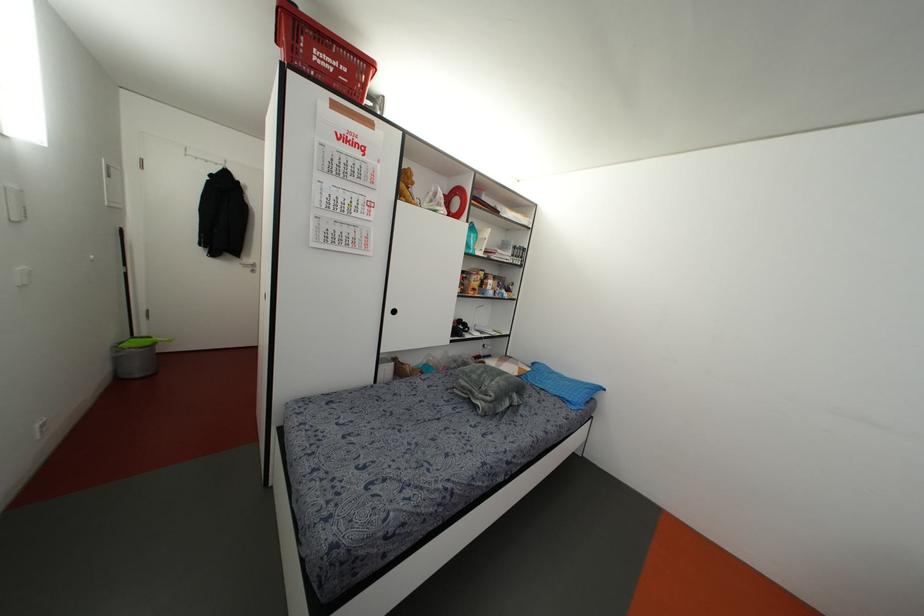
The image size is (924, 616). I want to click on silver bucket, so click(x=134, y=358).